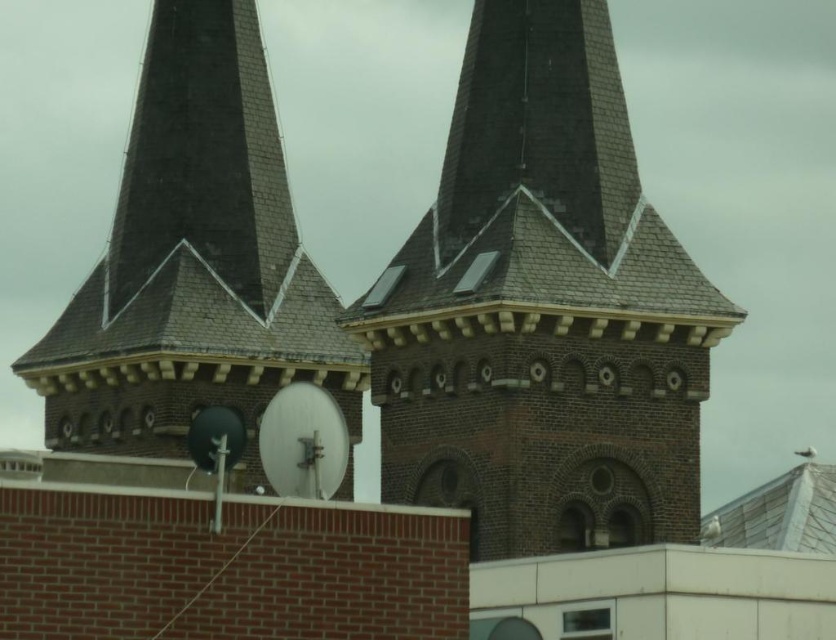
You are an architect examining the two towers in the image. You need to determine the spatial relationship between the brown brick tower at center and the dark gray shingles at center. Based on their positions, which one is located to the right of the other?

The brown brick tower at center is positioned on the right side of dark gray shingles at center, so the brown brick tower at center is to the right of the dark gray shingles at center.

You are standing at the base of the brown brick tower at center and want to place a ladder to reach the dark gray shingles at center. Given that the ladder you have is 18 meters long, will it be sufficient to reach the shingles?

The brown brick tower at center is 17.36 meters away from the dark gray shingles at center. Since the ladder is 18 meters long, which is longer than the distance, it will be sufficient to reach the shingles.